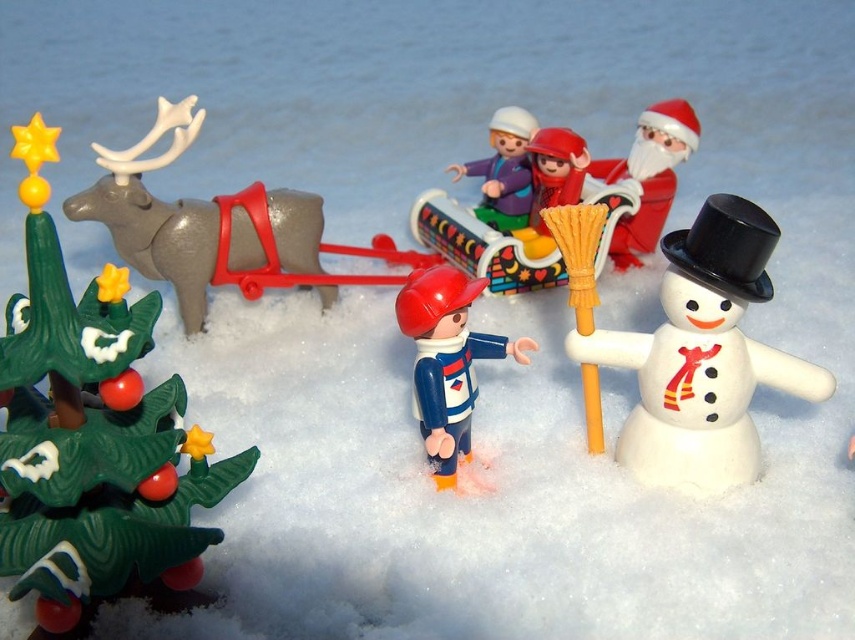
You are a toy organizer who needs to place the gray matte reindeer at left and the smooth plastic sleigh at center into storage boxes. The reindeer box can hold items up to 30 cm wide, and the sleigh box can hold items up to 25 cm wide. Based on the scene, will both toys fit into their respective boxes?

The gray matte reindeer at left is larger in width than the smooth plastic sleigh at center. Since the reindeer box has a 30 cm width limit and the sleigh box has a 25 cm limit, the reindeer might exceed the sleigh box capacity, but both could fit if the reindeer is within 30 cm. However, without exact measurements, we can only confirm the sleigh fits in its box if it is under 25 cm, but the reindeer may or may not fit depending on its exact width.

In the winter scene, there are a green plastic Christmas tree at left and a gray matte reindeer at left. Which object is closer to the snowman?

The green plastic Christmas tree at left is positioned under the gray matte reindeer at left, so the gray matte reindeer at left is closer to the snowman.